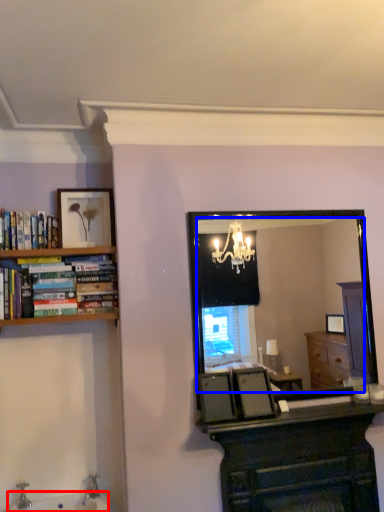
Question: Which point is closer to the camera, sink (highlighted by a red box) or mirror (highlighted by a blue box)?

Choices:
 (A) sink
 (B) mirror

Answer: (A)